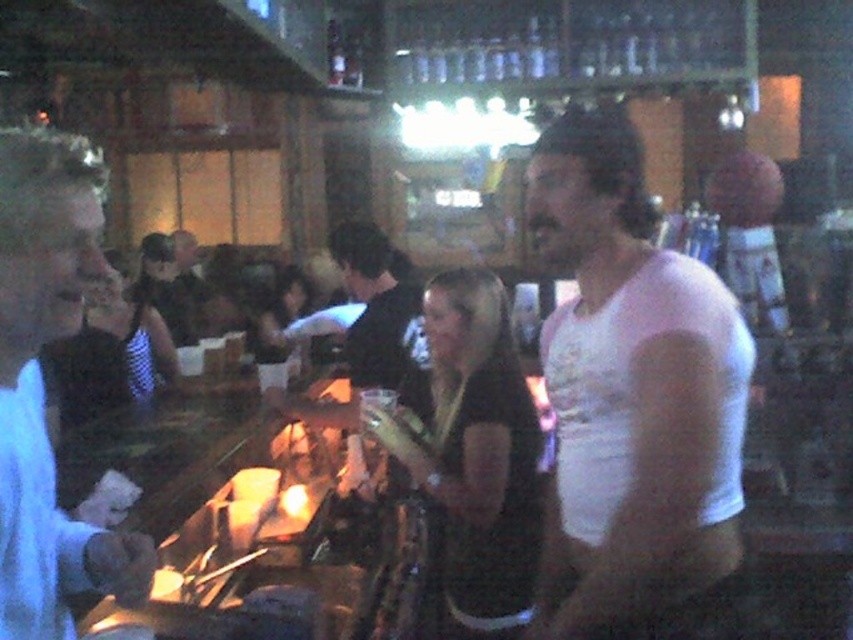
Question: Does black matte dress at center appear on the right side of black shirt at center?

Choices:
 (A) yes
 (B) no

Answer: (A)

Question: Among these points, which one is nearest to the camera?

Choices:
 (A) (136, 381)
 (B) (85, 148)
 (C) (473, 360)
 (D) (668, 356)

Answer: (B)

Question: Does white matte shirt at left appear over dark brown leather jacket at center?

Choices:
 (A) yes
 (B) no

Answer: (B)

Question: Can you confirm if white matte shirt at left is positioned to the right of black matte dress at center?

Choices:
 (A) yes
 (B) no

Answer: (B)

Question: Which object appears farthest from the camera in this image?

Choices:
 (A) black shirt at center
 (B) white cotton t-shirt at right
 (C) dark brown leather jacket at center
 (D) black mesh dress at center

Answer: (C)

Question: Among these points, which one is farthest from the camera?

Choices:
 (A) (453, 624)
 (B) (183, 260)
 (C) (578, 260)
 (D) (42, 618)

Answer: (B)